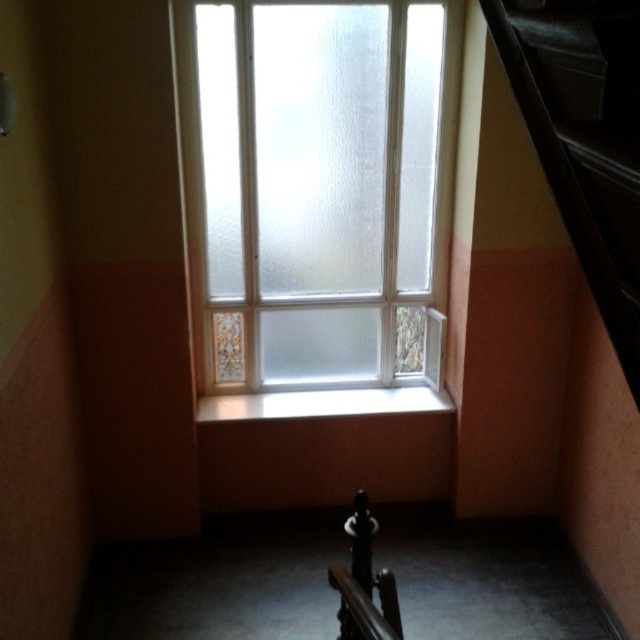
Question: Which is farther from the polished dark wood handrail at lower center?

Choices:
 (A) black leather stairs at right
 (B) white glossy window sill at center

Answer: (B)

Question: Is frosted glass window at upper center positioned at the back of black leather stairs at right?

Choices:
 (A) no
 (B) yes

Answer: (B)

Question: Can you confirm if frosted glass window at upper center is positioned to the left of black leather stairs at right?

Choices:
 (A) yes
 (B) no

Answer: (A)

Question: Is frosted glass window at upper center positioned in front of black leather stairs at right?

Choices:
 (A) no
 (B) yes

Answer: (A)

Question: Which of the following is the closest to the observer?

Choices:
 (A) (392, 576)
 (B) (522, 67)
 (C) (225, 93)

Answer: (B)

Question: Which object is closer to the camera taking this photo?

Choices:
 (A) black leather stairs at right
 (B) white glossy window sill at center
 (C) polished dark wood handrail at lower center
 (D) frosted glass window at upper center

Answer: (A)